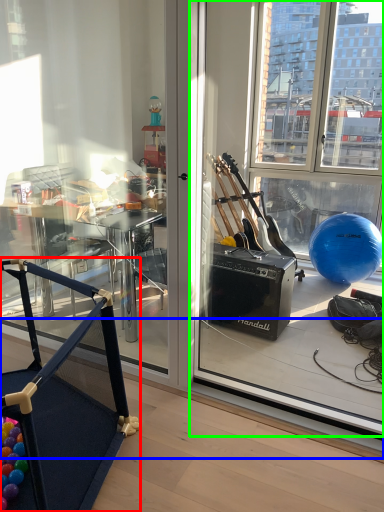
Question: Which object is the closest to the furniture (highlighted by a red box)? Choose among these: window sill (highlighted by a blue box) or window screen (highlighted by a green box).

Choices:
 (A) window sill
 (B) window screen

Answer: (A)